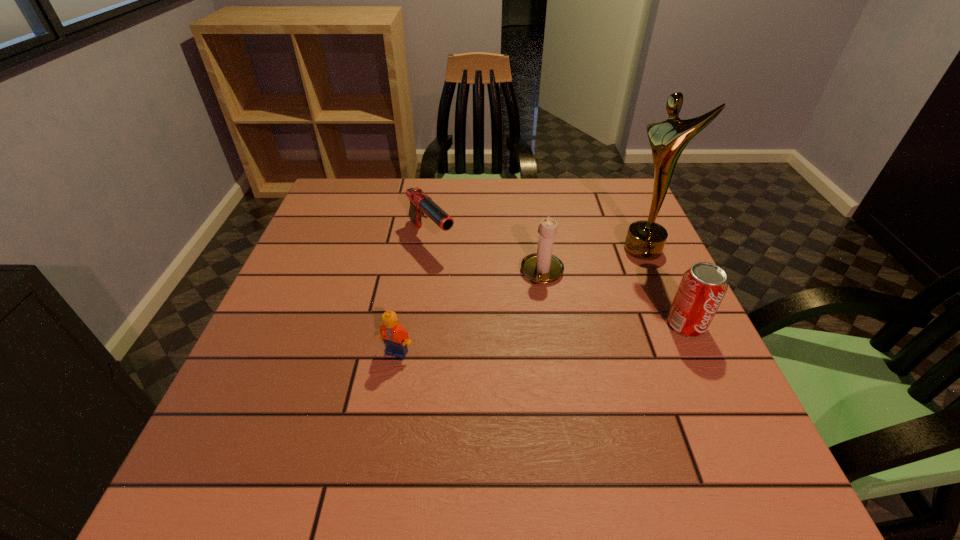
Locate an element on the screen. Lego is located at coordinates (395, 337).

Where is `the second nearest object`? Image resolution: width=960 pixels, height=540 pixels. the second nearest object is located at coordinates (702, 288).

In order to click on gun in this screenshot , I will do `click(420, 203)`.

At what (x,y) coordinates should I click in order to perform the action: click on the tallest object. Please return your answer as a coordinate pair (x, y). The image size is (960, 540). Looking at the image, I should click on (645, 240).

At what (x,y) coordinates should I click in order to perform the action: click on the third object from left to right. Please return your answer as a coordinate pair (x, y). Image resolution: width=960 pixels, height=540 pixels. Looking at the image, I should click on (542, 267).

In order to click on free space located 0.130m on the front-facing side of the nearest object in this screenshot , I will do `click(385, 420)`.

Image resolution: width=960 pixels, height=540 pixels. I want to click on vacant space located 0.140m on the front of the fourth farthest object, so click(720, 399).

You are a GUI agent. You are given a task and a screenshot of the screen. Output one action in this format:
    pyautogui.click(x=<x>, y=<y>)
    Task: Click on the vacant space located at the aiming end of the gun
    This screenshot has width=960, height=540.
    Given the screenshot: What is the action you would take?
    pyautogui.click(x=472, y=285)

I want to click on free spot located at the aiming end of the gun, so click(470, 282).

Where is `free spot located 0.070m at the aiming end of the gun`? free spot located 0.070m at the aiming end of the gun is located at coordinates (459, 271).